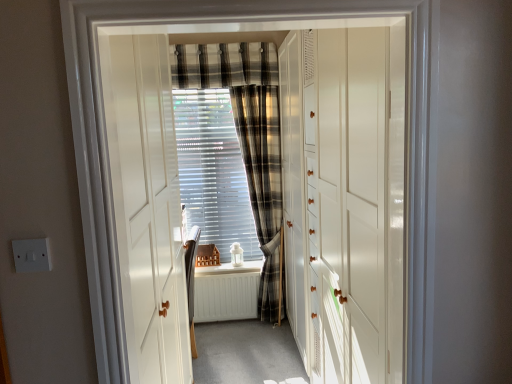
Where is `blank space situated above translucent plastic blinds at center (from a real-world perspective)`? This screenshot has height=384, width=512. blank space situated above translucent plastic blinds at center (from a real-world perspective) is located at coordinates (199, 92).